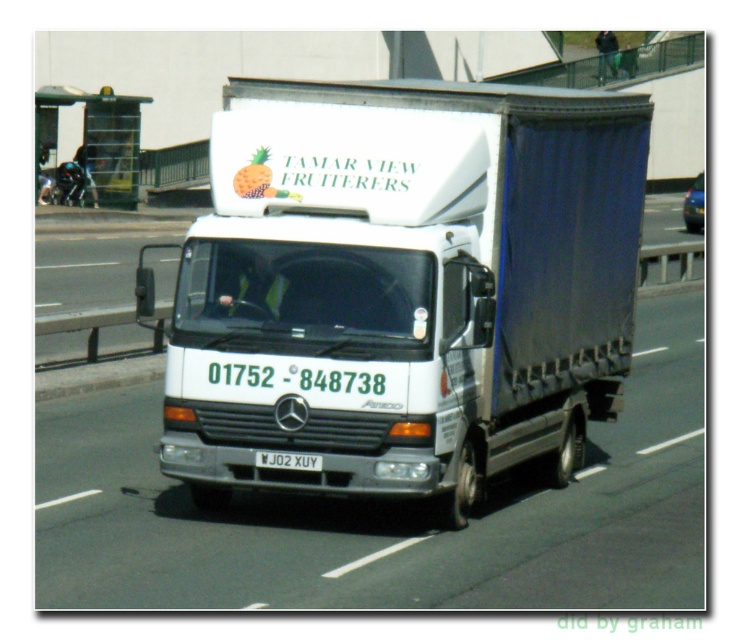
Question: Can you confirm if white matte truck at center is positioned to the right of white plastic license plate at center?

Choices:
 (A) no
 (B) yes

Answer: (B)

Question: Among these points, which one is farthest from the camera?

Choices:
 (A) (178, 440)
 (B) (696, 179)
 (C) (320, 458)

Answer: (B)

Question: Which point is closer to the camera?

Choices:
 (A) (282, 369)
 (B) (289, 458)

Answer: (A)

Question: Is white matte truck at center thinner than white plastic license plate at center?

Choices:
 (A) yes
 (B) no

Answer: (B)

Question: Where is white plastic license plate at center located in relation to metallic blue taxi at center in the image?

Choices:
 (A) above
 (B) below

Answer: (B)

Question: Estimate the real-world distances between objects in this image. Which object is farther from the white matte truck at center?

Choices:
 (A) white plastic license plate at center
 (B) metallic blue taxi at center

Answer: (B)